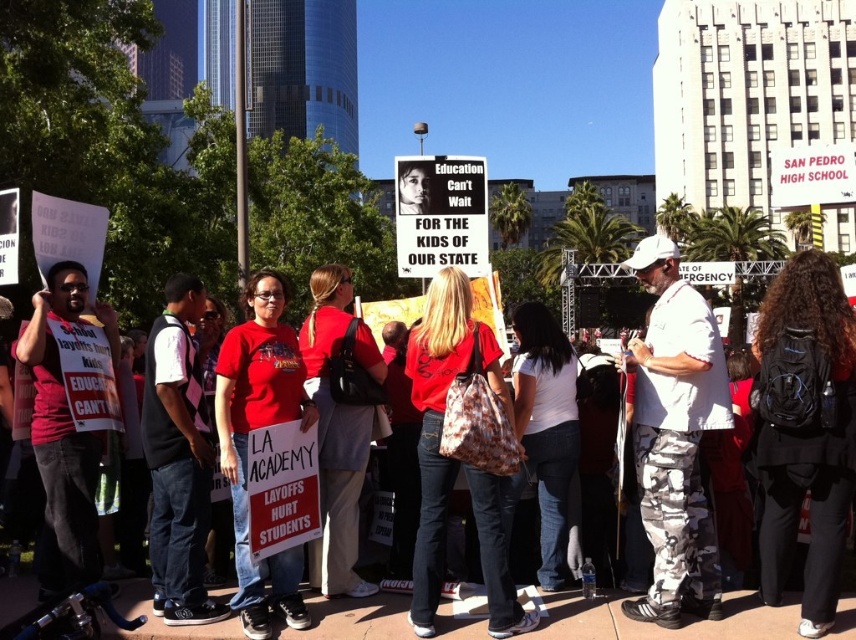
You are a photographer who needs to capture a clear shot of the white camouflage pants at center from your camera. Given that the distance between them is 89.88 feet, will you be able to focus on the subject without moving closer?

The white camouflage pants at center and camera are 89.88 feet apart, so yes, you can focus on the white camouflage pants at center from that distance as modern cameras can focus at such distances without needing to move closer.

You are a photographer trying to capture a clear shot of both the white camouflage pants at center and the matte red shirt at center. Since you want to ensure both are visible in your frame, which object should you position closer to the edge of your camera view to avoid overlap?

The white camouflage pants at center is positioned on the right side of matte red shirt at center, so to avoid overlap, position the white camouflage pants at center closer to the right edge of your camera view.